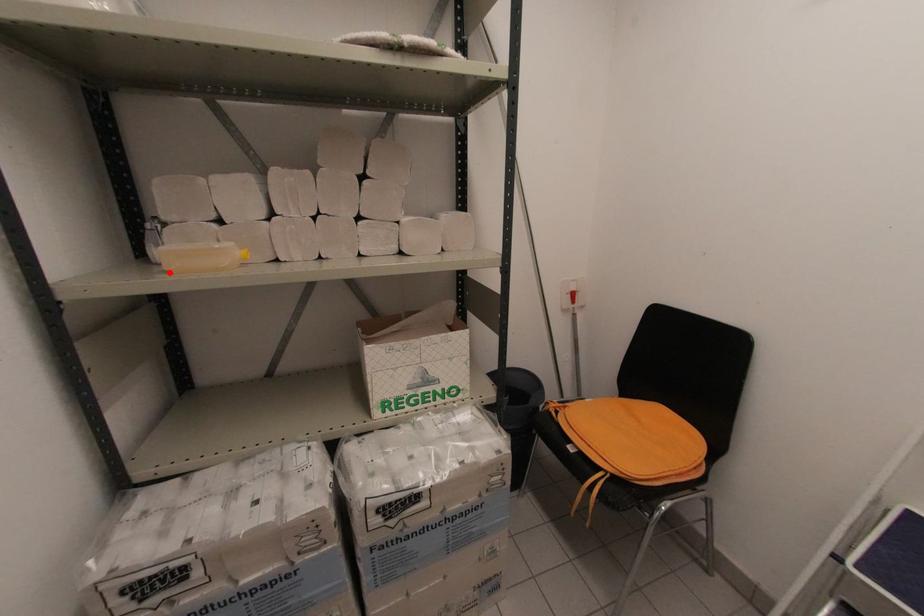
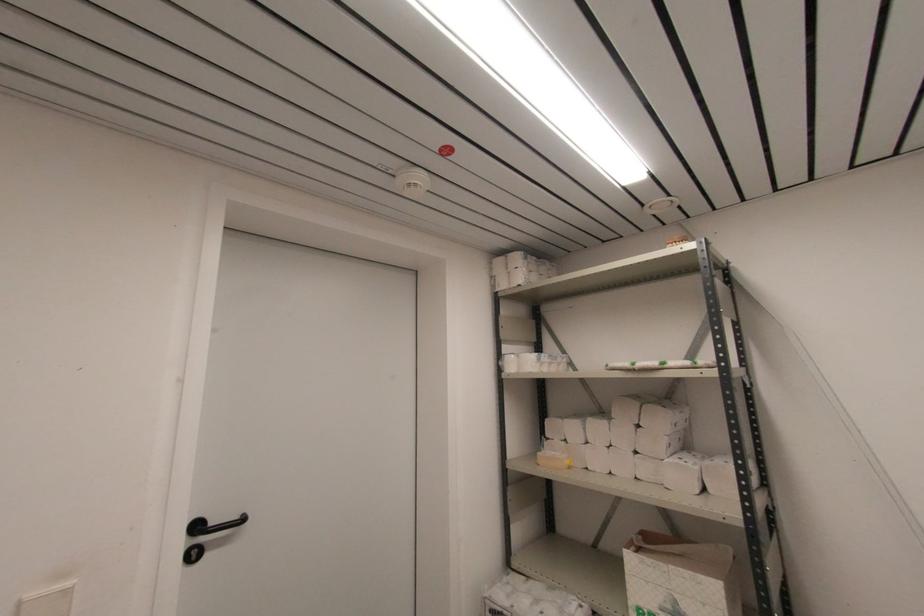
Locate, in the second image, the point that corresponds to the highlighted location in the first image.

(540, 464)